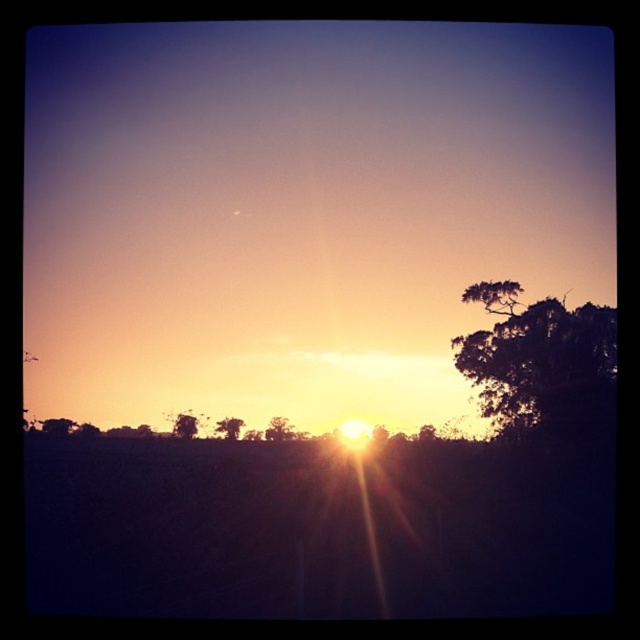
Can you confirm if green leafy tree at center is positioned above brown textured tree at center?

No.

Who is taller, green leafy tree at center or brown textured tree at center?

Standing taller between the two is green leafy tree at center.

Where is `green leafy tree at center`? The width and height of the screenshot is (640, 640). green leafy tree at center is located at coordinates (280, 429).

The image size is (640, 640). Describe the element at coordinates (184, 426) in the screenshot. I see `green matte tree at center` at that location.

Consider the image. Does green matte tree at center have a greater width compared to brown textured tree at center?

In fact, green matte tree at center might be narrower than brown textured tree at center.

Measure the distance between point (184, 428) and camera.

Point (184, 428) is 11.72 meters away from camera.

You are a GUI agent. You are given a task and a screenshot of the screen. Output one action in this format:
    pyautogui.click(x=<x>, y=<y>)
    Task: Click on the green matte tree at center
    
    Given the screenshot: What is the action you would take?
    pyautogui.click(x=184, y=426)

Does green leafy tree at center appear on the right side of green matte tree at center?

Correct, you'll find green leafy tree at center to the right of green matte tree at center.

Does green leafy tree at center appear over green matte tree at center?

No.

Measure the distance between green leafy tree at center and camera.

11.88 meters

The width and height of the screenshot is (640, 640). Find the location of `green leafy tree at center`. green leafy tree at center is located at coordinates (280, 429).